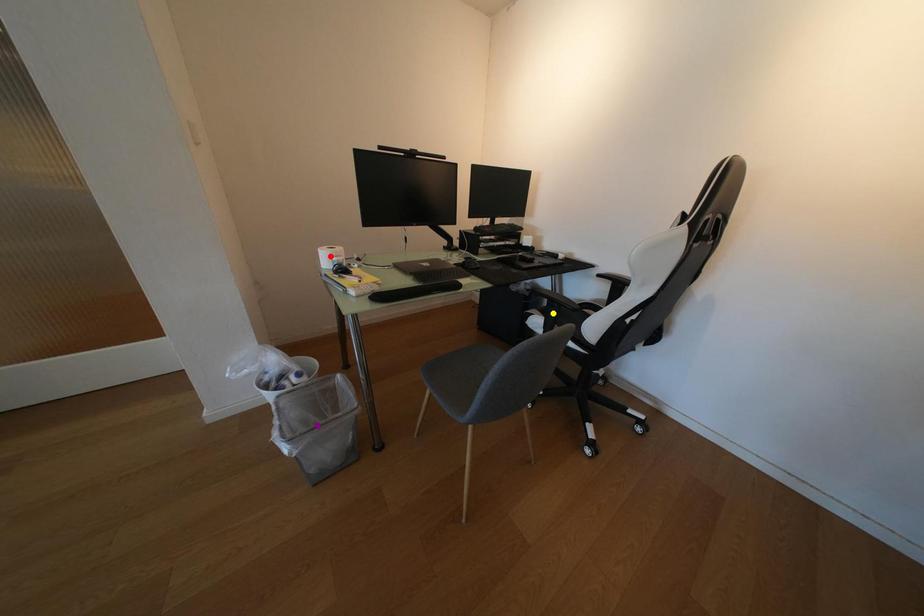
Order these from nearest to farthest:
- red point
- yellow point
- purple point

purple point < red point < yellow point